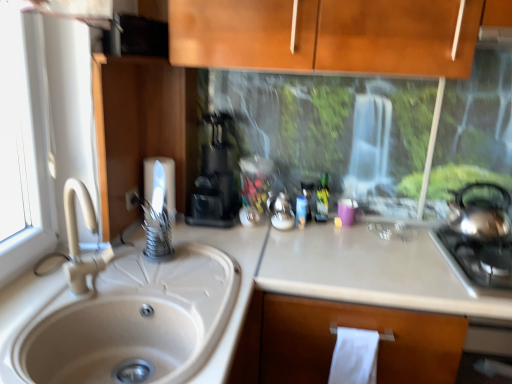
Identify the location of free space in front of metallic silver kettle at center. (290, 241).